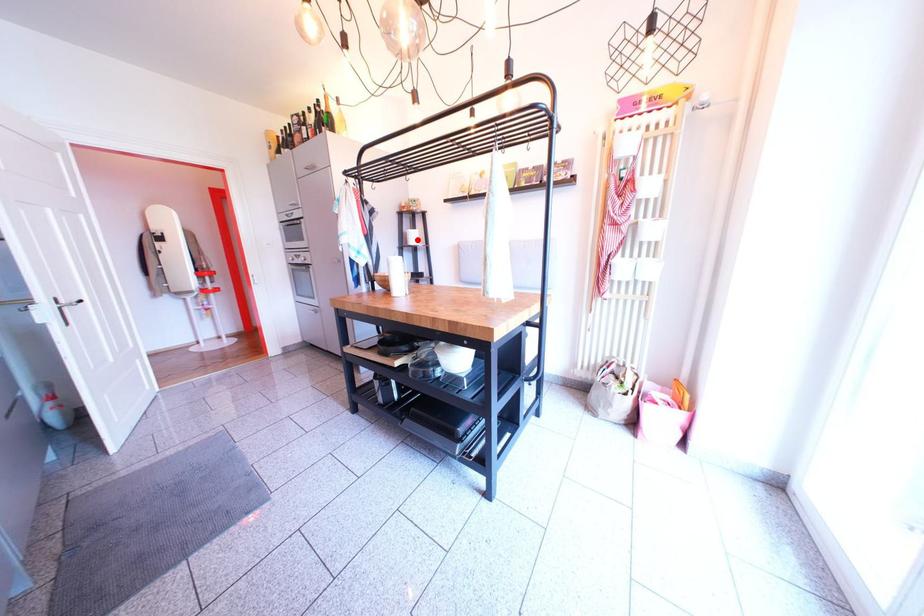
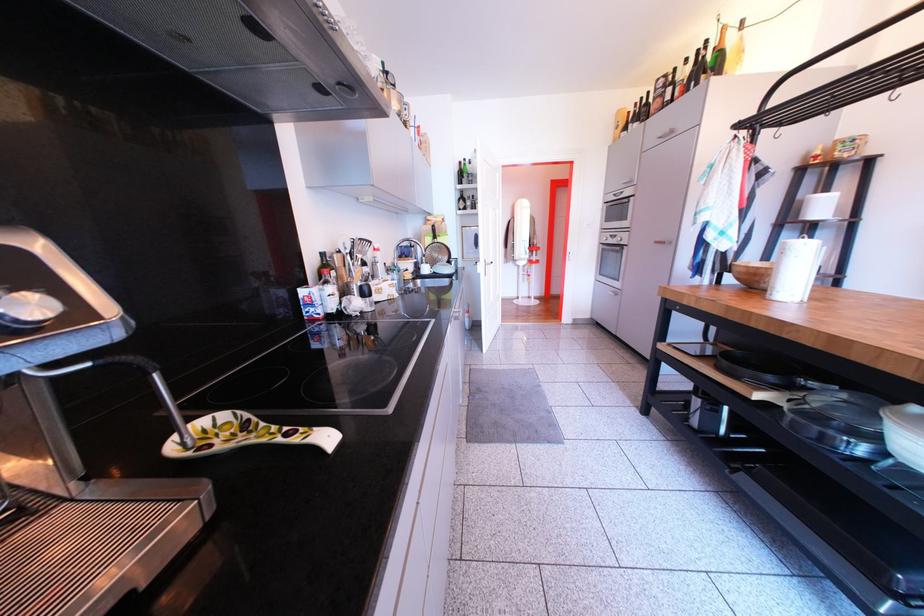
Question: A red point is marked in image1. In image2, is the corresponding 3D point closer to the camera or farther? Reply with the corresponding letter.

Choices:
 (A) The corresponding 3D point is closer.
 (B) The corresponding 3D point is farther.

Answer: (B)